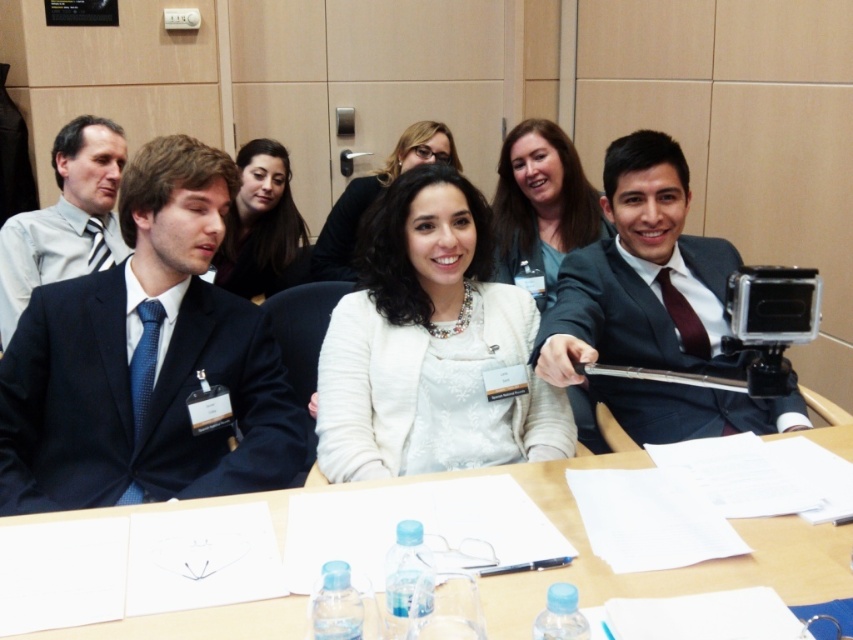
Is white paper at center positioned behind matte black suit at left?

No, white paper at center is in front of matte black suit at left.

Is white paper at center above matte black suit at left?

Incorrect, white paper at center is not positioned above matte black suit at left.

Identify the location of white paper at center. The width and height of the screenshot is (853, 640). (670, 570).

Identify the location of white paper at center. The image size is (853, 640). (670, 570).

Does white paper at center have a larger size compared to matte white jacket at center?

Actually, white paper at center might be smaller than matte white jacket at center.

Does white paper at center lie in front of matte white jacket at center?

Yes, white paper at center is in front of matte white jacket at center.

I want to click on white paper at center, so click(x=670, y=570).

You are a GUI agent. You are given a task and a screenshot of the screen. Output one action in this format:
    pyautogui.click(x=<x>, y=<y>)
    Task: Click on the white paper at center
    Image resolution: width=853 pixels, height=640 pixels.
    Given the screenshot: What is the action you would take?
    pyautogui.click(x=670, y=570)

Consider the image. Does dark blue suit at left have a lesser width compared to matte black jacket at center?

No, dark blue suit at left is not thinner than matte black jacket at center.

Does dark blue suit at left appear on the right side of matte black jacket at center?

Indeed, dark blue suit at left is positioned on the right side of matte black jacket at center.

You are a GUI agent. You are given a task and a screenshot of the screen. Output one action in this format:
    pyautogui.click(x=<x>, y=<y>)
    Task: Click on the dark blue suit at left
    The image size is (853, 640).
    Given the screenshot: What is the action you would take?
    pos(146,360)